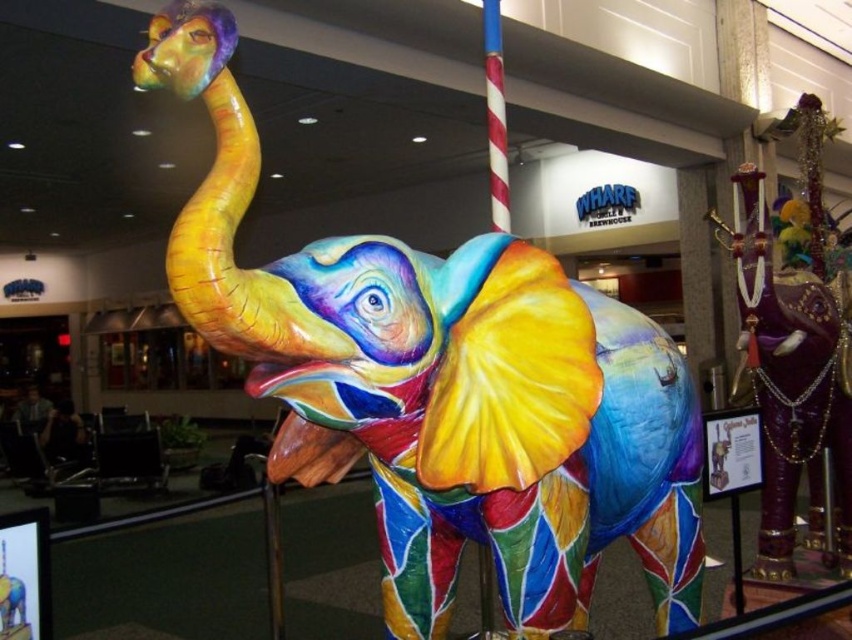
Question: Which point is farther to the camera?

Choices:
 (A) shiny purple elephant at right
 (B) multicolored painted elephant at center
 (C) red and white striped pole at center

Answer: (A)

Question: Estimate the real-world distances between objects in this image. Which object is farther from the red and white striped pole at center?

Choices:
 (A) multicolored painted elephant at center
 (B) shiny purple elephant at right

Answer: (B)

Question: Considering the relative positions of multicolored painted elephant at center and red and white striped pole at center in the image provided, where is multicolored painted elephant at center located with respect to red and white striped pole at center?

Choices:
 (A) below
 (B) above

Answer: (A)

Question: Which point is closer to the camera taking this photo?

Choices:
 (A) (240, 289)
 (B) (827, 504)

Answer: (A)

Question: Does shiny purple elephant at right have a greater width compared to red and white striped pole at center?

Choices:
 (A) yes
 (B) no

Answer: (A)

Question: In this image, where is multicolored painted elephant at center located relative to red and white striped pole at center?

Choices:
 (A) left
 (B) right

Answer: (A)